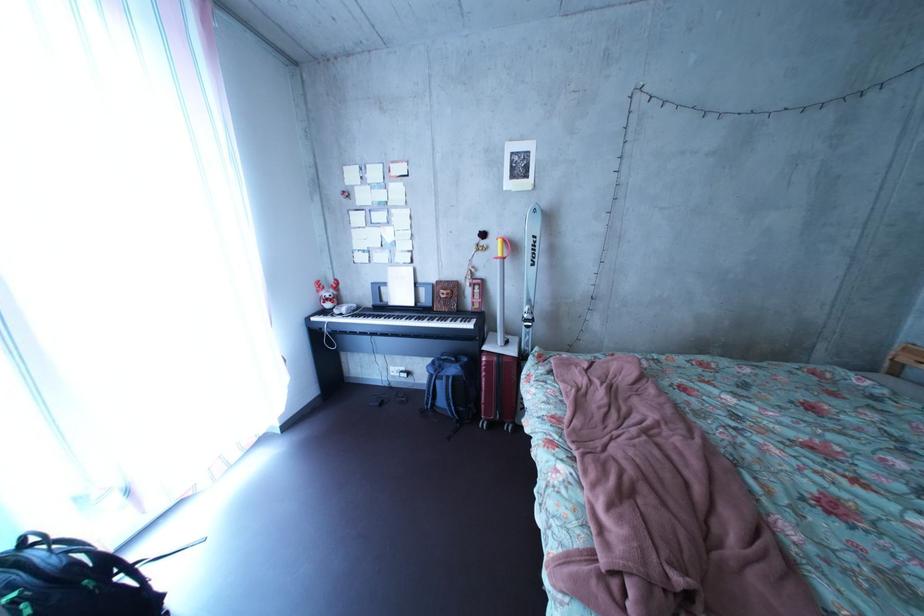
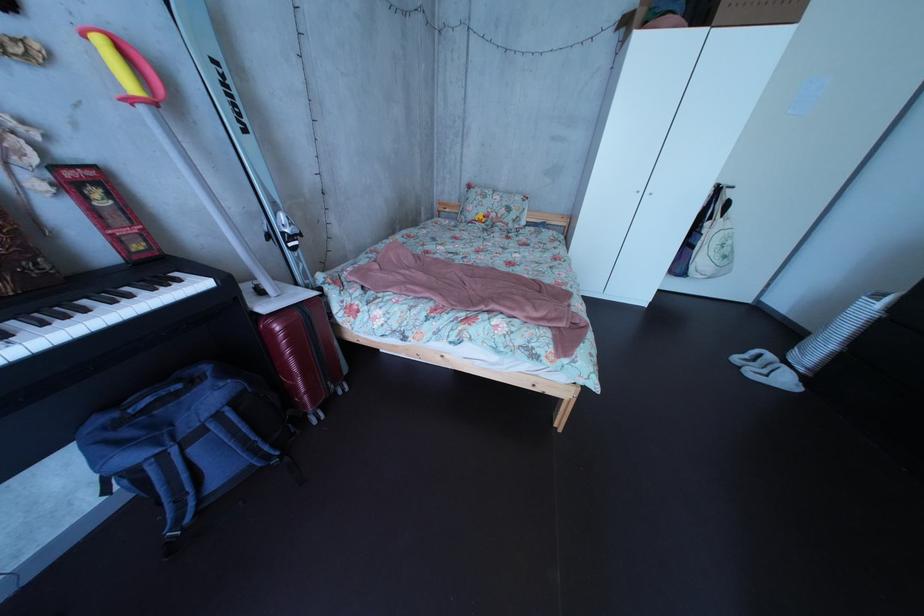
In the second image, find the point that corresponds to point (514, 249) in the first image.

(116, 51)